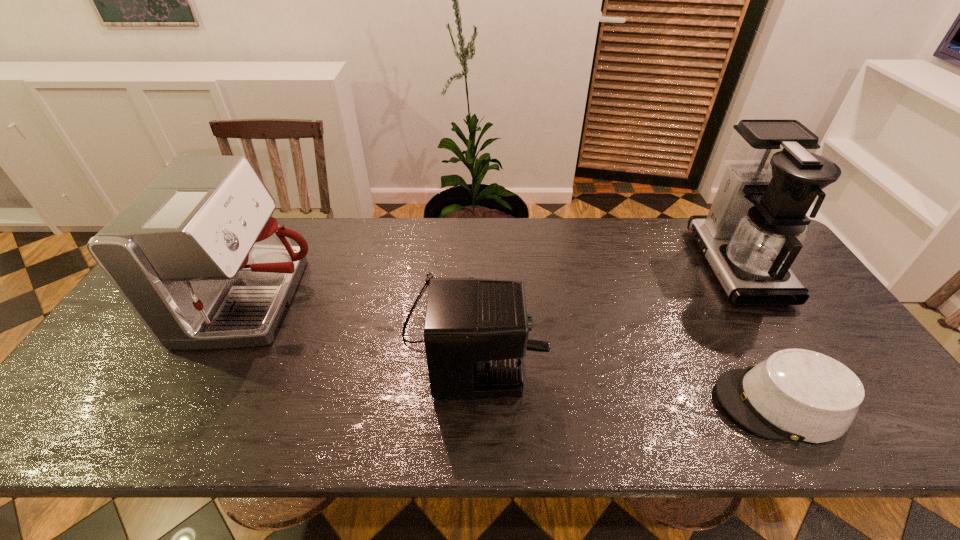
I want to click on the second closest coffee maker to the leftmost object, so click(x=756, y=225).